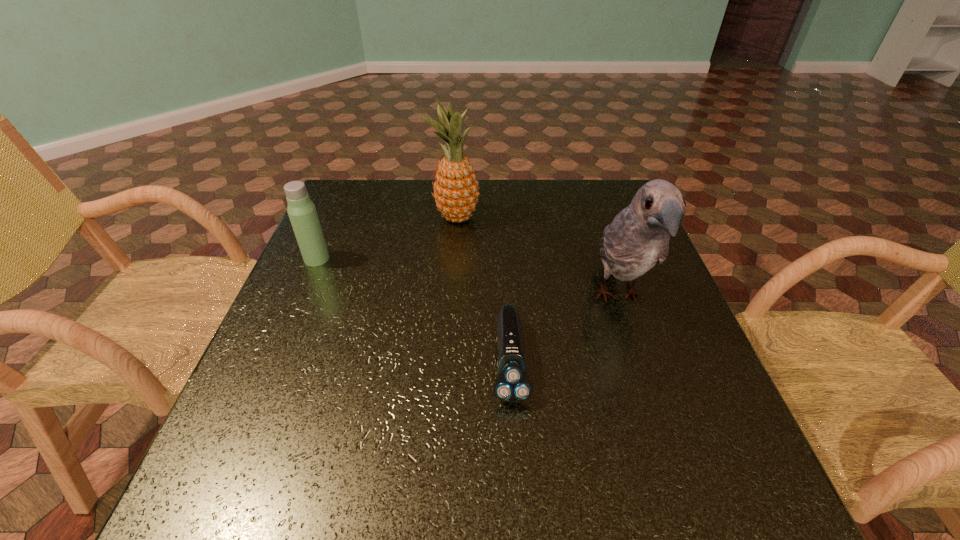
I want to click on the third closest object to the rightmost object, so click(x=302, y=213).